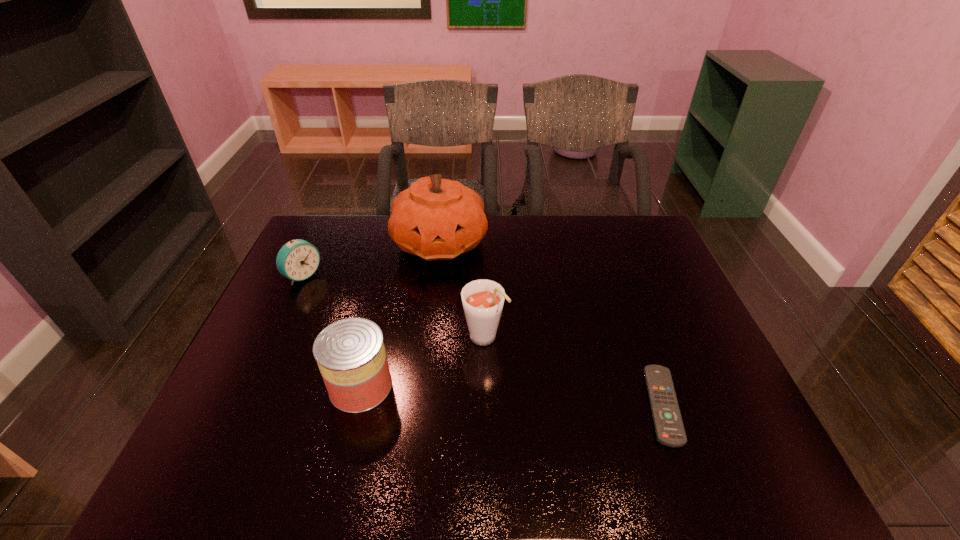
In order to click on can present at the near edge in this screenshot , I will do `click(350, 353)`.

I want to click on remote control present at the near edge, so click(669, 428).

Locate an element on the screen. The image size is (960, 540). object present at the left edge is located at coordinates (297, 260).

In order to click on object at the right edge in this screenshot , I will do `click(669, 428)`.

I want to click on object situated at the near right corner, so click(669, 428).

In the image, there is a desktop. Where is `vacant space at the far edge`? vacant space at the far edge is located at coordinates (548, 221).

This screenshot has width=960, height=540. Identify the location of blank area at the near edge. (436, 424).

Identify the location of vacant space at the right edge of the desktop. (671, 375).

Find the location of a particular element. The image size is (960, 540). free space at the far left corner of the desktop is located at coordinates (337, 249).

This screenshot has width=960, height=540. I want to click on vacant region at the near left corner of the desktop, so click(x=216, y=412).